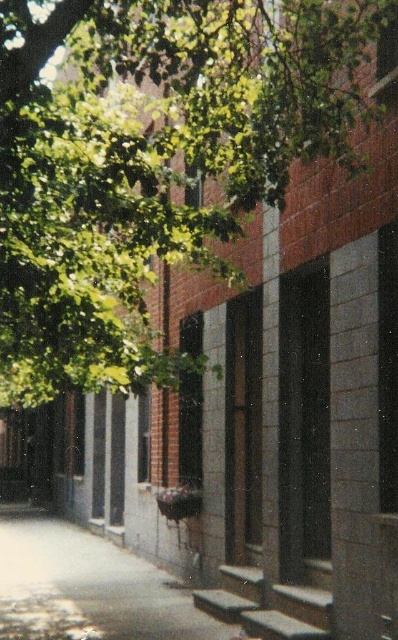
Does point (267, 125) lie in front of point (202, 628)?

Yes.

This screenshot has height=640, width=398. In order to click on green leafy tree at upper left in this screenshot , I will do [150, 160].

This screenshot has height=640, width=398. I want to click on green leafy tree at upper left, so click(x=150, y=160).

Image resolution: width=398 pixels, height=640 pixels. I want to click on green leafy tree at upper left, so click(x=150, y=160).